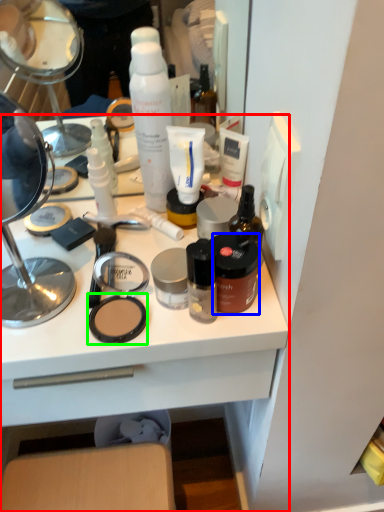
Question: Estimate the real-world distances between objects in this image. Which object is farther from desk (highlighted by a red box), toiletry (highlighted by a blue box) or face powder (highlighted by a green box)?

Choices:
 (A) toiletry
 (B) face powder

Answer: (A)